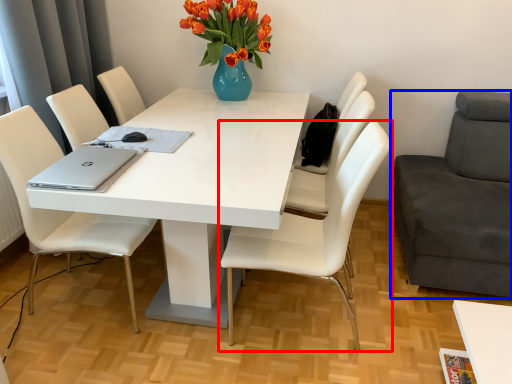
Question: Which point is further to the camera, chair (highlighted by a red box) or chair (highlighted by a blue box)?

Choices:
 (A) chair
 (B) chair

Answer: (A)